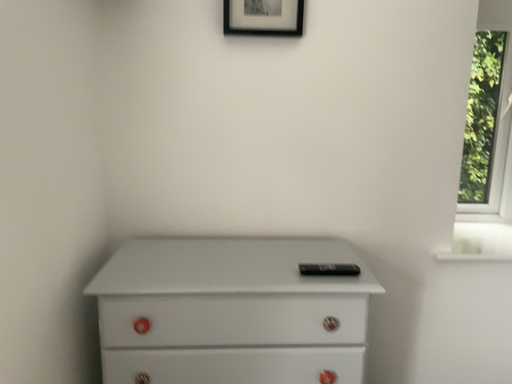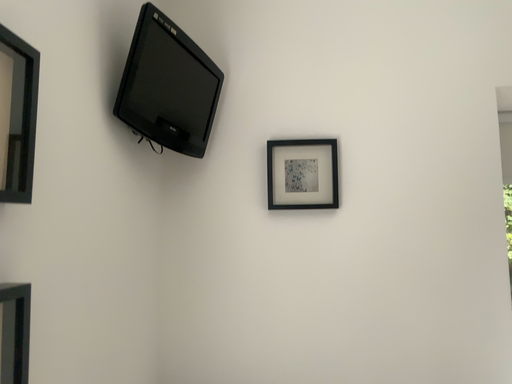
Question: Which way did the camera rotate in the video?

Choices:
 (A) rotated downward
 (B) rotated upward

Answer: (B)